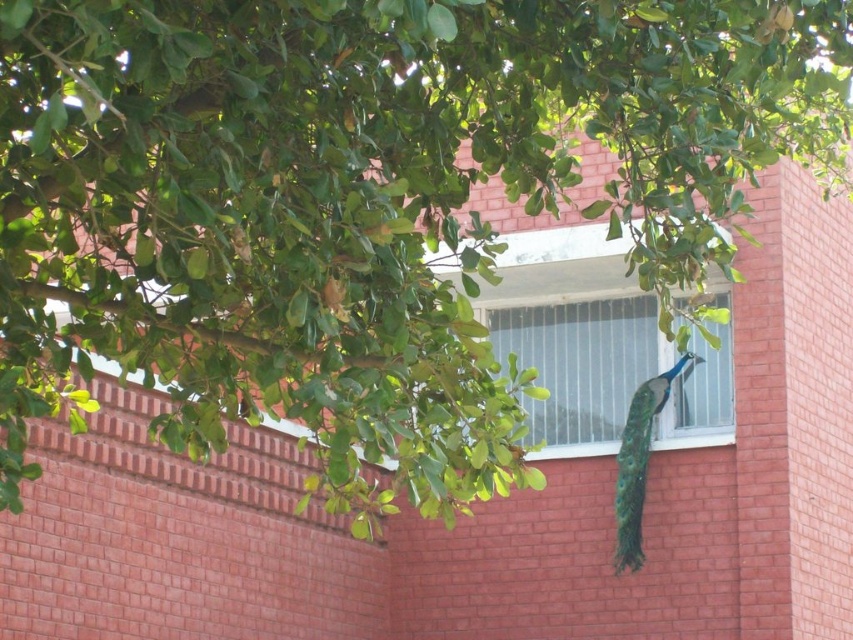
Can you confirm if clear glass window at center is bigger than shiny green peacock tail at center?

Indeed, clear glass window at center has a larger size compared to shiny green peacock tail at center.

Does clear glass window at center have a greater width compared to shiny green peacock tail at center?

Yes.

In order to click on clear glass window at center in this screenshot , I will do `click(579, 365)`.

Where is `clear glass window at center`? The image size is (853, 640). clear glass window at center is located at coordinates (579, 365).

Which is above, clear glass window at center or green iridescent peacock at center?

clear glass window at center is higher up.

Who is more distant from viewer, [724,410] or [619,540]?

The point [724,410] is more distant.

Where is `clear glass window at center`? The width and height of the screenshot is (853, 640). clear glass window at center is located at coordinates (579, 365).

Who is more distant from viewer, (643, 458) or (625, 548)?

The point (643, 458) is more distant.

Is green iridescent peacock at center to the right of shiny green peacock tail at center from the viewer's perspective?

Indeed, green iridescent peacock at center is positioned on the right side of shiny green peacock tail at center.

Locate an element on the screen. The image size is (853, 640). green iridescent peacock at center is located at coordinates (639, 461).